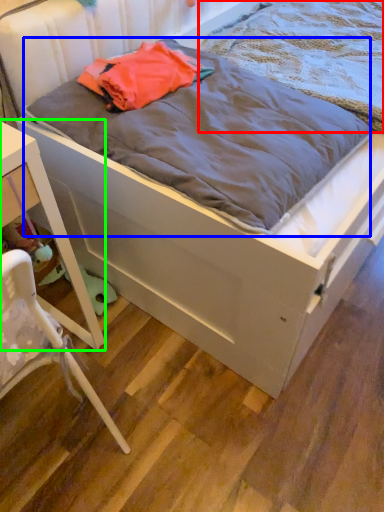
Question: Which is farther away from blanket (highlighted by a red box)? blanket (highlighted by a blue box) or nightstand (highlighted by a green box)?

Choices:
 (A) blanket
 (B) nightstand

Answer: (B)